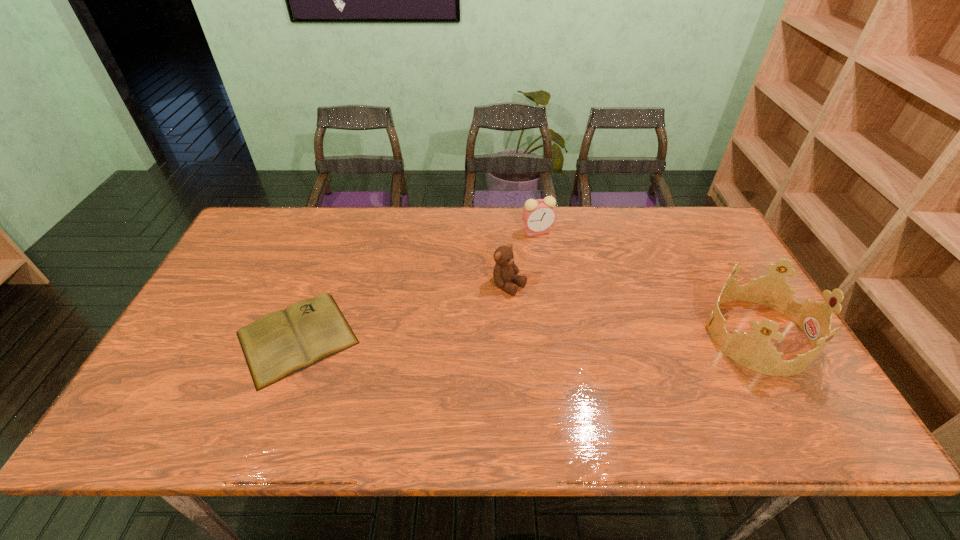
I want to click on vacant spot on the desktop that is between the leftmost object and the tiara and is positioned on the face of the alarm clock, so click(473, 337).

Where is `vacant space on the desktop that is between the leftmost object and the rightmost object and is positioned on the face of the teddy bear`? vacant space on the desktop that is between the leftmost object and the rightmost object and is positioned on the face of the teddy bear is located at coordinates (594, 336).